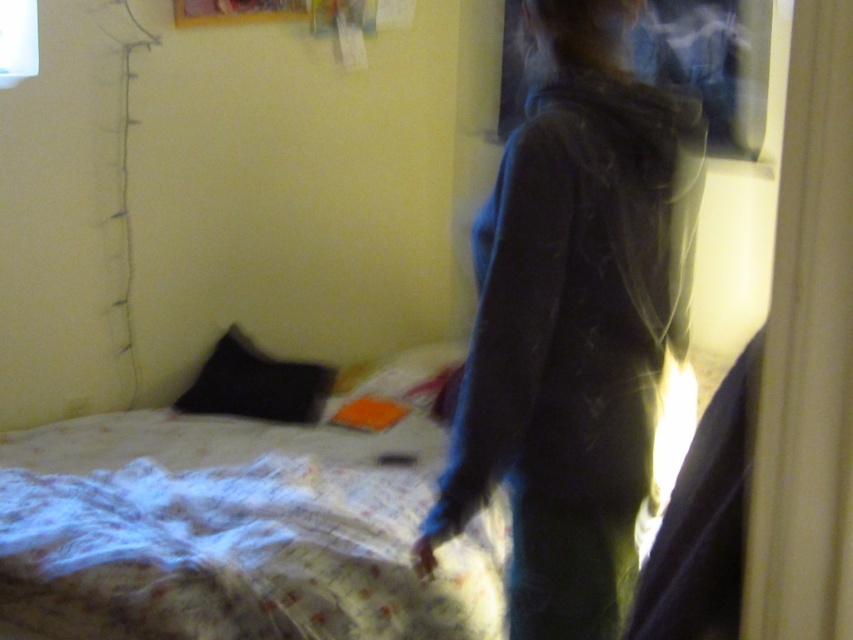
You are standing in the bedroom and want to reach the white textured bed at center. Is the dark blue hoodie at center blocking your path to the bed?

The dark blue hoodie at center is closer to the viewer than the white textured bed at center, so it is blocking the path to the bed.

You are organizing a bedroom and need to place the dark blue hoodie at center and the white textured bed at center. According to the scene, which object is on top of the other?

The dark blue hoodie at center is positioned over the white textured bed at center.